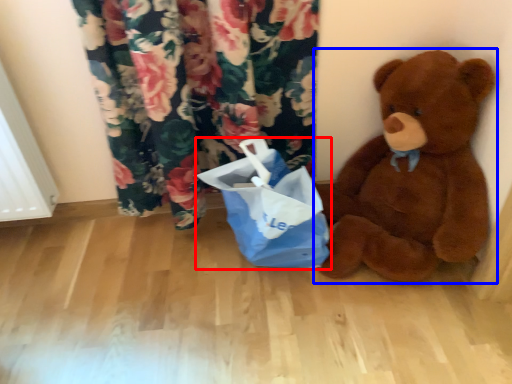
Question: Which of the following is the closest to the observer, shopping bag (highlighted by a red box) or teddy bear (highlighted by a blue box)?

Choices:
 (A) shopping bag
 (B) teddy bear

Answer: (B)